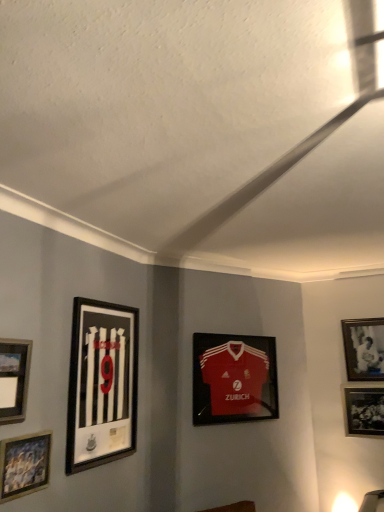
Question: From a real-world perspective, does matte plastic picture frame at center, which is counted as the 3th picture frame, starting from the right, stand above white matte picture frame at upper right, which is the 1th picture frame from right to left?

Choices:
 (A) yes
 (B) no

Answer: (B)

Question: Is matte plastic picture frame at center, which is counted as the 3th picture frame, starting from the right, smaller than white matte picture frame at upper right, which is the 1th picture frame from right to left?

Choices:
 (A) yes
 (B) no

Answer: (B)

Question: Is white matte picture frame at upper right, arranged as the 6th picture frame when viewed from the left, at the back of matte plastic picture frame at center, acting as the 4th picture frame starting from the left?

Choices:
 (A) no
 (B) yes

Answer: (A)

Question: Is matte plastic picture frame at center, which is counted as the 3th picture frame, starting from the right, positioned before white matte picture frame at upper right, arranged as the 6th picture frame when viewed from the left?

Choices:
 (A) no
 (B) yes

Answer: (B)

Question: Would you say matte plastic picture frame at center, acting as the 4th picture frame starting from the left, is a long distance from white matte picture frame at upper right, arranged as the 6th picture frame when viewed from the left?

Choices:
 (A) yes
 (B) no

Answer: (A)

Question: Does matte plastic picture frame at center, which is counted as the 3th picture frame, starting from the right, lie behind white matte picture frame at upper right, arranged as the 6th picture frame when viewed from the left?

Choices:
 (A) yes
 (B) no

Answer: (B)

Question: Is matte silver picture frame at lower left, the sixth picture frame when ordered from right to left, in front of black matte picture frame at left, the 4th picture frame in the right-to-left sequence?

Choices:
 (A) no
 (B) yes

Answer: (B)

Question: Can you confirm if matte silver picture frame at lower left, the first picture frame when ordered from left to right, is thinner than black matte picture frame at left, the 4th picture frame in the right-to-left sequence?

Choices:
 (A) yes
 (B) no

Answer: (A)

Question: Is matte silver picture frame at lower left, the first picture frame when ordered from left to right, surrounding black matte picture frame at left, positioned as the 3th picture frame in left-to-right order?

Choices:
 (A) yes
 (B) no

Answer: (B)

Question: Does matte silver picture frame at lower left, the first picture frame when ordered from left to right, come behind black matte picture frame at left, the 4th picture frame in the right-to-left sequence?

Choices:
 (A) yes
 (B) no

Answer: (B)

Question: Does matte silver picture frame at lower left, the sixth picture frame when ordered from right to left, have a larger size compared to black matte picture frame at left, positioned as the 3th picture frame in left-to-right order?

Choices:
 (A) no
 (B) yes

Answer: (A)

Question: From a real-world perspective, is matte silver picture frame at lower left, the sixth picture frame when ordered from right to left, below black matte picture frame at left, the 4th picture frame in the right-to-left sequence?

Choices:
 (A) no
 (B) yes

Answer: (A)

Question: From a real-world perspective, is black matte picture frame at left, the 4th picture frame in the right-to-left sequence, over wooden picture frame at lower left, acting as the fifth picture frame starting from the right?

Choices:
 (A) no
 (B) yes

Answer: (B)